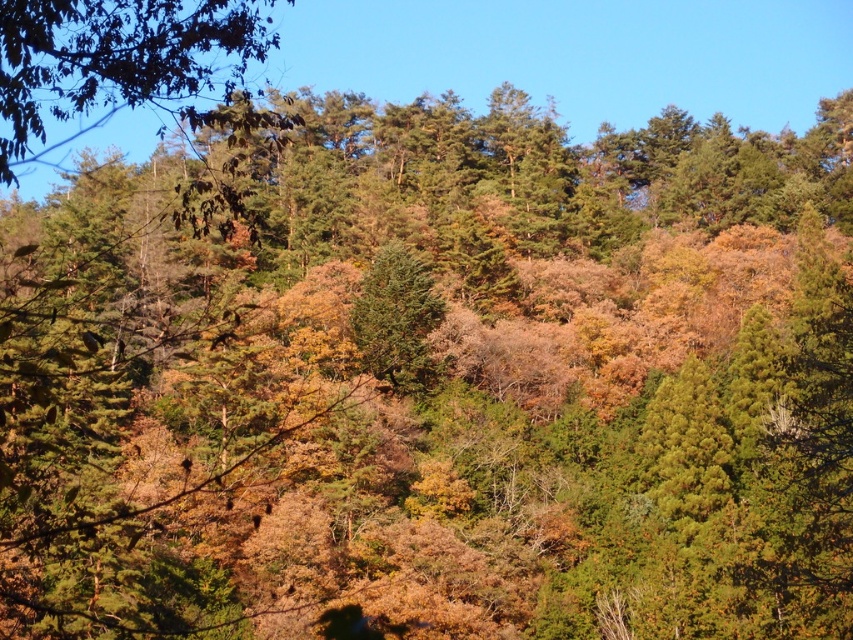
Question: Which point is closer to the camera?

Choices:
 (A) green matte tree at upper left
 (B) green matte tree at center

Answer: (A)

Question: Which point is farther to the camera?

Choices:
 (A) green matte tree at upper left
 (B) green matte tree at center

Answer: (B)

Question: Observing the image, what is the correct spatial positioning of green matte tree at upper left in reference to green matte tree at center?

Choices:
 (A) below
 (B) above

Answer: (B)

Question: Is the position of green matte tree at upper left less distant than that of green matte tree at center?

Choices:
 (A) yes
 (B) no

Answer: (A)

Question: Can you confirm if green matte tree at upper left is positioned to the right of green matte tree at center?

Choices:
 (A) yes
 (B) no

Answer: (B)